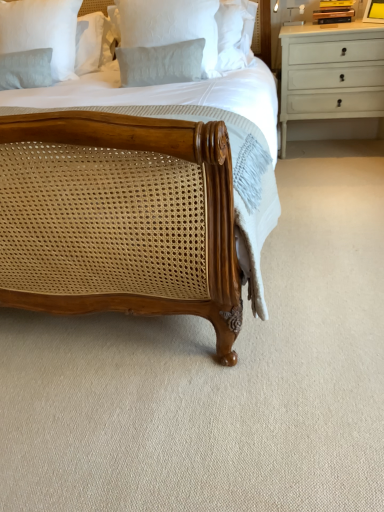
Question: Should I look upward or downward to see yellow matte picture frame at upper right?

Choices:
 (A) down
 (B) up

Answer: (B)

Question: Can you confirm if yellow matte picture frame at upper right is thinner than light gray textured pillow at upper left, which is the second pillow from right to left?

Choices:
 (A) yes
 (B) no

Answer: (A)

Question: Is yellow matte picture frame at upper right further to the viewer compared to light gray textured pillow at upper left, positioned as the first pillow in left-to-right order?

Choices:
 (A) no
 (B) yes

Answer: (B)

Question: From a real-world perspective, is yellow matte picture frame at upper right physically above light gray textured pillow at upper left, positioned as the first pillow in left-to-right order?

Choices:
 (A) no
 (B) yes

Answer: (B)

Question: Can you confirm if yellow matte picture frame at upper right is wider than light gray textured pillow at upper left, which is the second pillow from right to left?

Choices:
 (A) no
 (B) yes

Answer: (A)

Question: Is yellow matte picture frame at upper right shorter than light gray textured pillow at upper left, the 2th pillow positioned from the front?

Choices:
 (A) no
 (B) yes

Answer: (B)

Question: From the image's perspective, is yellow matte picture frame at upper right located above light gray textured pillow at upper left, which is the second pillow from right to left?

Choices:
 (A) no
 (B) yes

Answer: (B)

Question: Is the position of yellow matte picture frame at upper right less distant than that of white painted wood chest of drawers at upper right?

Choices:
 (A) no
 (B) yes

Answer: (B)

Question: Is yellow matte picture frame at upper right positioned with its back to white painted wood chest of drawers at upper right?

Choices:
 (A) no
 (B) yes

Answer: (A)

Question: From the image's perspective, is yellow matte picture frame at upper right on white painted wood chest of drawers at upper right?

Choices:
 (A) no
 (B) yes

Answer: (B)

Question: Is yellow matte picture frame at upper right further to camera compared to white painted wood chest of drawers at upper right?

Choices:
 (A) no
 (B) yes

Answer: (A)

Question: From the image's perspective, would you say yellow matte picture frame at upper right is shown under white painted wood chest of drawers at upper right?

Choices:
 (A) no
 (B) yes

Answer: (A)

Question: Is yellow matte picture frame at upper right not within white painted wood chest of drawers at upper right?

Choices:
 (A) yes
 (B) no

Answer: (A)

Question: Can you confirm if light gray textured pillow at upper left, which is the second pillow from right to left, is positioned to the left of yellow matte picture frame at upper right?

Choices:
 (A) no
 (B) yes

Answer: (B)